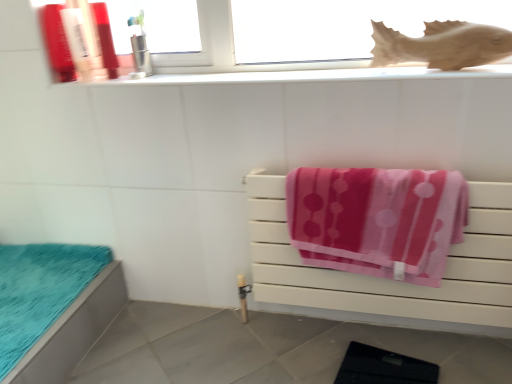
Question: Is white glossy window sill at upper center bigger or smaller than matte plastic bottle at upper left, marked as the third toiletry in a right-to-left arrangement?

Choices:
 (A) small
 (B) big

Answer: (B)

Question: Considering their positions, is white glossy window sill at upper center located in front of or behind matte plastic bottle at upper left, marked as the 2th toiletry in a left-to-right arrangement?

Choices:
 (A) front
 (B) behind

Answer: (A)

Question: Which of these objects is positioned farthest from the transparent glass window at upper center?

Choices:
 (A) brown matte fish at upper right
 (B) matte plastic bottle at upper left, marked as the third toiletry in a right-to-left arrangement
 (C) pink fabric towel at center
 (D) matte plastic bottle at upper left, acting as the 4th toiletry starting from the right
 (E) pink soft towel at center right

Answer: (C)

Question: Estimate the real-world distances between objects in this image. Which object is closer to the shiny plastic toothbrush at upper left, which ranks as the second toiletry in right-to-left order?

Choices:
 (A) white glossy window sill at upper center
 (B) transparent glass window at upper center
 (C) brown matte fish at upper right
 (D) teal fabric bed at lower left
 (E) pink soft towel at center right

Answer: (B)